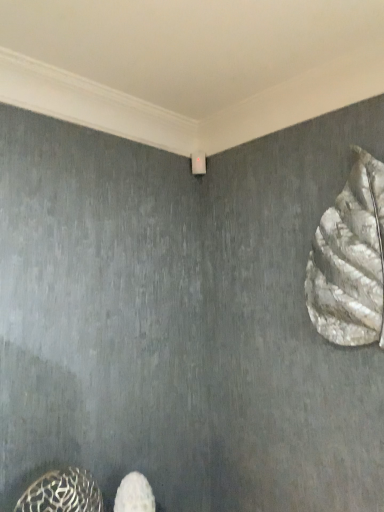
Question: Would you say white fabric shoe at lower center is a long distance from white textured sculpture at right, the 1th animal viewed from the right?

Choices:
 (A) no
 (B) yes

Answer: (A)

Question: Considering the relative positions of white fabric shoe at lower center and white textured sculpture at right, placed as the 2th animal when sorted from left to right, in the image provided, is white fabric shoe at lower center in front of white textured sculpture at right, placed as the 2th animal when sorted from left to right,?

Choices:
 (A) no
 (B) yes

Answer: (A)

Question: Does white fabric shoe at lower center turn towards white textured sculpture at right, placed as the 2th animal when sorted from left to right?

Choices:
 (A) yes
 (B) no

Answer: (B)

Question: Considering the relative sizes of white fabric shoe at lower center and white textured sculpture at right, the 1th animal viewed from the right, in the image provided, is white fabric shoe at lower center wider than white textured sculpture at right, the 1th animal viewed from the right,?

Choices:
 (A) yes
 (B) no

Answer: (A)

Question: Does white fabric shoe at lower center appear on the right side of white textured sculpture at right, which ranks as the 1th animal in top-to-bottom order?

Choices:
 (A) yes
 (B) no

Answer: (B)

Question: Is white fabric shoe at lower center positioned beyond the bounds of white textured sculpture at right, which ranks as the 1th animal in top-to-bottom order?

Choices:
 (A) no
 (B) yes

Answer: (B)

Question: Is white textured sculpture at right, which ranks as the 1th animal in top-to-bottom order, smaller than white fabric shoe at lower center?

Choices:
 (A) no
 (B) yes

Answer: (A)

Question: Is white textured sculpture at right, placed as the 2th animal when sorted from left to right, at the left side of white fabric shoe at lower center?

Choices:
 (A) yes
 (B) no

Answer: (B)

Question: From a real-world perspective, is white textured sculpture at right, which ranks as the 1th animal in top-to-bottom order, beneath white fabric shoe at lower center?

Choices:
 (A) no
 (B) yes

Answer: (A)

Question: Is white textured sculpture at right, the 1th animal viewed from the right, taller than white fabric shoe at lower center?

Choices:
 (A) no
 (B) yes

Answer: (B)

Question: From a real-world perspective, does white textured sculpture at right, the 1th animal viewed from the right, stand above white fabric shoe at lower center?

Choices:
 (A) no
 (B) yes

Answer: (B)

Question: Is white textured sculpture at right, the 1th animal viewed from the right, aimed at white fabric shoe at lower center?

Choices:
 (A) yes
 (B) no

Answer: (B)

Question: Does white fabric shoe at lower center come behind metallic patterned shoe at lower left, marked as the first animal in a bottom-to-top arrangement?

Choices:
 (A) no
 (B) yes

Answer: (B)